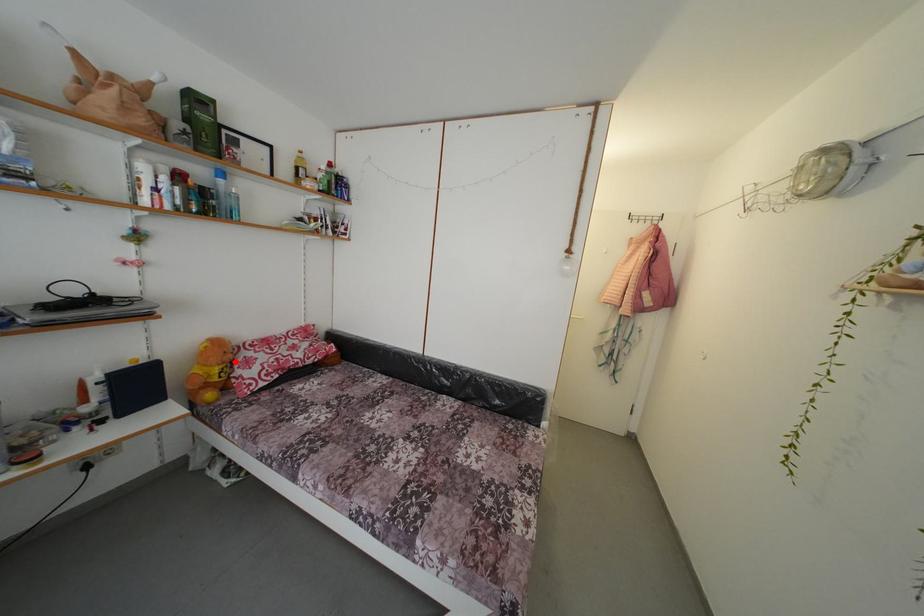
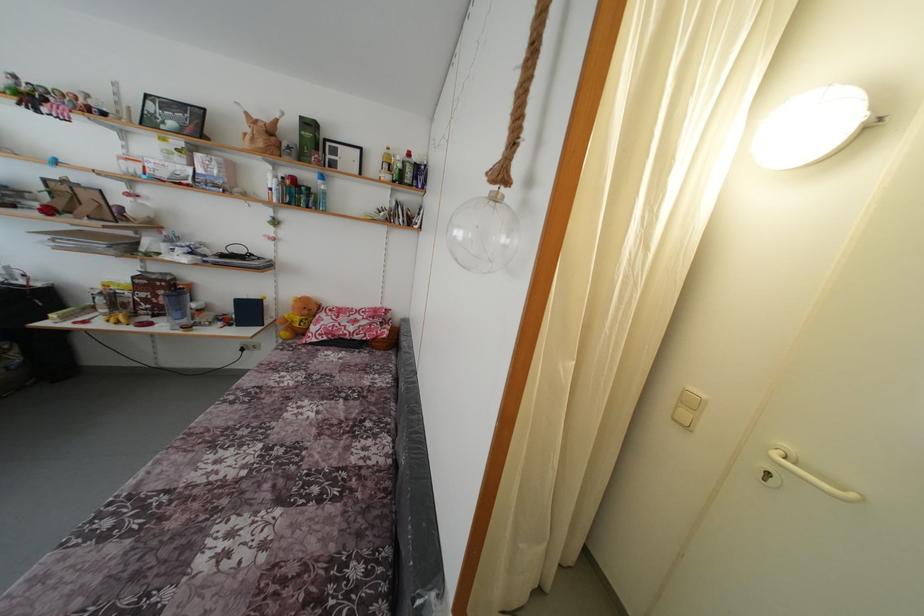
Find the pixel in the second image that matches the highlighted location in the first image.

(310, 317)